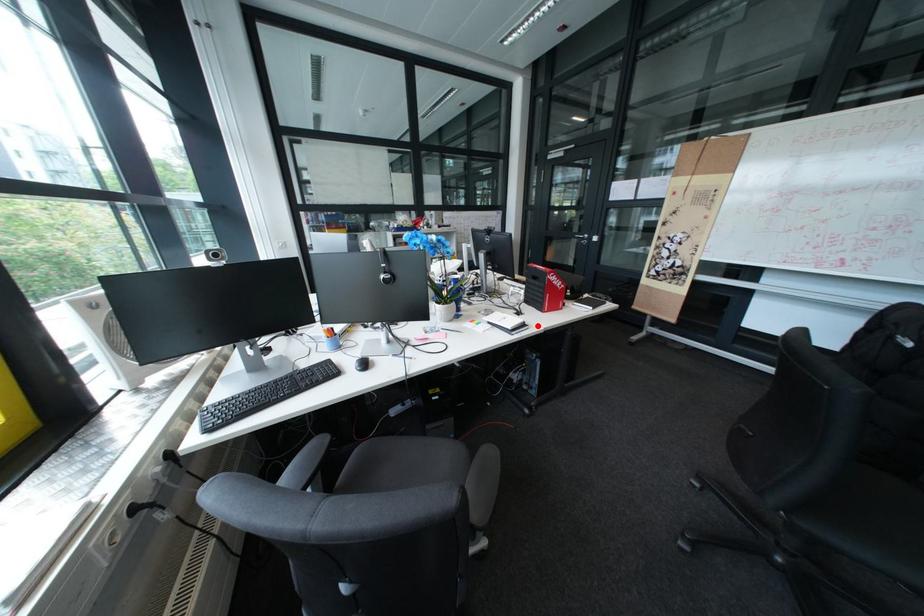
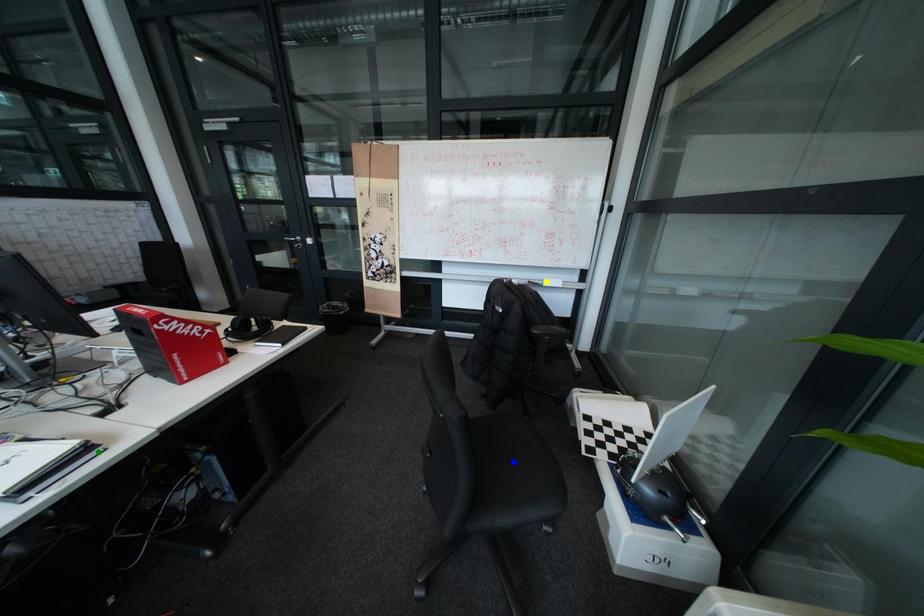
Question: I am providing you with two images of the same scene from different viewpoints. A red point is marked on the first image. You are given multiple points on the second image. Which point in image 2 is actually the same real-world point as the red point in image 1?

Choices:
 (A) blue point
 (B) green point
 (C) yellow point

Answer: (B)